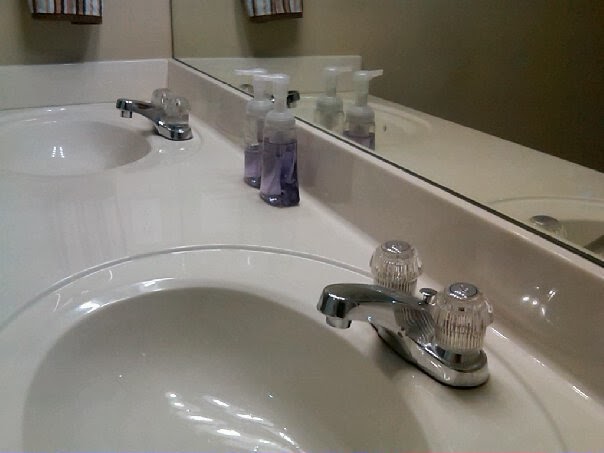
You are a GUI agent. You are given a task and a screenshot of the screen. Output one action in this format:
    pyautogui.click(x=<x>, y=<y>)
    Task: Click on the hot water knob
    
    Given the screenshot: What is the action you would take?
    pyautogui.click(x=461, y=328), pyautogui.click(x=180, y=107)